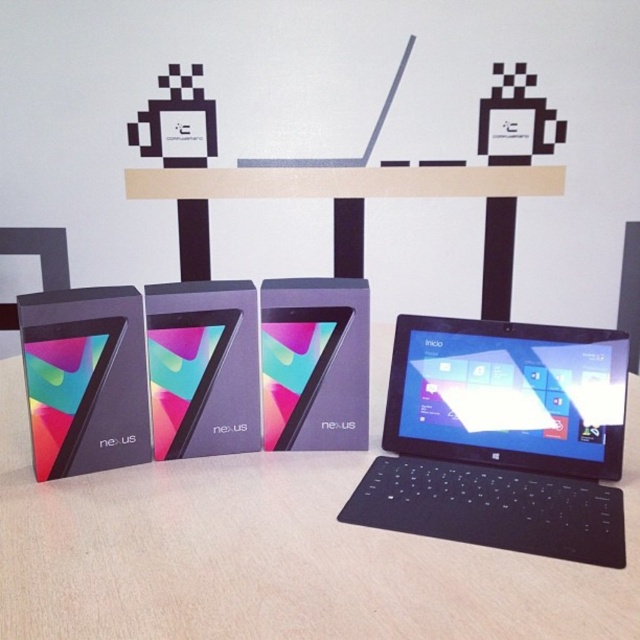
Locate an element on the screen. The height and width of the screenshot is (640, 640). matte black table at center is located at coordinates (275, 552).

Between point (337, 556) and point (468, 330), which one is positioned behind?

Point (468, 330)

You are a GUI agent. You are given a task and a screenshot of the screen. Output one action in this format:
    pyautogui.click(x=<x>, y=<y>)
    Task: Click on the matte black table at center
    This screenshot has height=640, width=640.
    Given the screenshot: What is the action you would take?
    pyautogui.click(x=275, y=552)

Who is positioned more to the left, matte black table at center or matte black tablet at center?

From the viewer's perspective, matte black table at center appears more on the left side.

In the scene shown: Does matte black table at center lie behind matte black tablet at center?

No, matte black table at center is in front of matte black tablet at center.

Who is more forward, (x=17, y=381) or (x=298, y=337)?

Point (x=298, y=337)

The height and width of the screenshot is (640, 640). I want to click on matte black table at center, so click(275, 552).

Can you confirm if black plastic table at center is positioned above matte black tablet at center?

Indeed, black plastic table at center is positioned over matte black tablet at center.

Does black plastic table at center have a greater height compared to matte black tablet at center?

No.

Is point (266, 180) positioned after point (298, 387)?

Yes, point (266, 180) is farther from viewer.

Image resolution: width=640 pixels, height=640 pixels. I want to click on black plastic table at center, so click(344, 182).